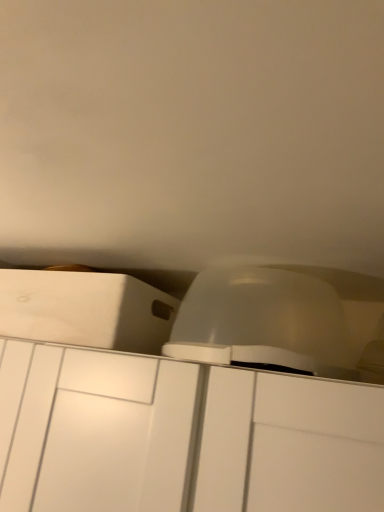
Question: Considering the positions of point (99, 287) and point (327, 284), is point (99, 287) closer or farther from the camera than point (327, 284)?

Choices:
 (A) farther
 (B) closer

Answer: (B)

Question: Do you think white matte cabinet at upper left, acting as the 2th cabinetry starting from the bottom, is within transparent plastic dome at center, or outside of it?

Choices:
 (A) inside
 (B) outside

Answer: (B)

Question: Estimate the real-world distances between objects in this image. Which object is farther from the white matte cabinet at center, which appears as the 1th cabinetry when ordered from the bottom?

Choices:
 (A) white matte cabinet at upper left, acting as the 2th cabinetry starting from the bottom
 (B) transparent plastic dome at center

Answer: (B)

Question: Which object is positioned farthest from the transparent plastic dome at center?

Choices:
 (A) white matte cabinet at center, which appears as the 1th cabinetry when ordered from the bottom
 (B) white matte cabinet at upper left, the 1th cabinetry when ordered from top to bottom

Answer: (A)